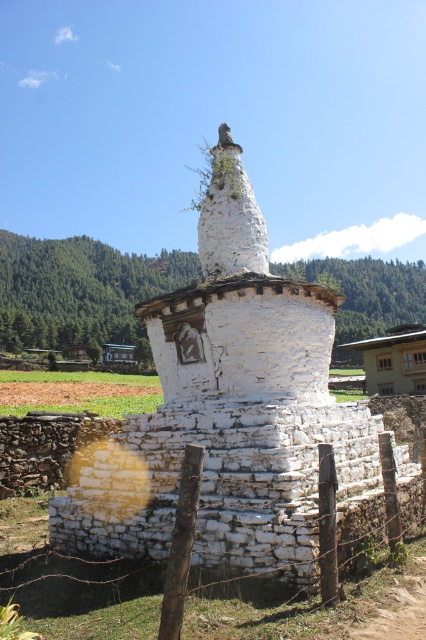
Question: Which point is farther from the camera taking this photo?

Choices:
 (A) (313, 397)
 (B) (380, 394)

Answer: (B)

Question: Among these points, which one is nearest to the camera?

Choices:
 (A) (380, 374)
 (B) (328, 320)

Answer: (B)

Question: Can you confirm if wooden post at center is positioned to the left of brown wooden hut at right?

Choices:
 (A) yes
 (B) no

Answer: (A)

Question: Can you confirm if white stone stupa at center is bigger than brown wooden hut at right?

Choices:
 (A) no
 (B) yes

Answer: (A)

Question: Based on their relative distances, which object is farther from the white stone stupa at center?

Choices:
 (A) wooden hut at lower left
 (B) wooden post at center

Answer: (A)

Question: Does white stone stupa at center have a smaller size compared to wooden hut at lower left?

Choices:
 (A) yes
 (B) no

Answer: (B)